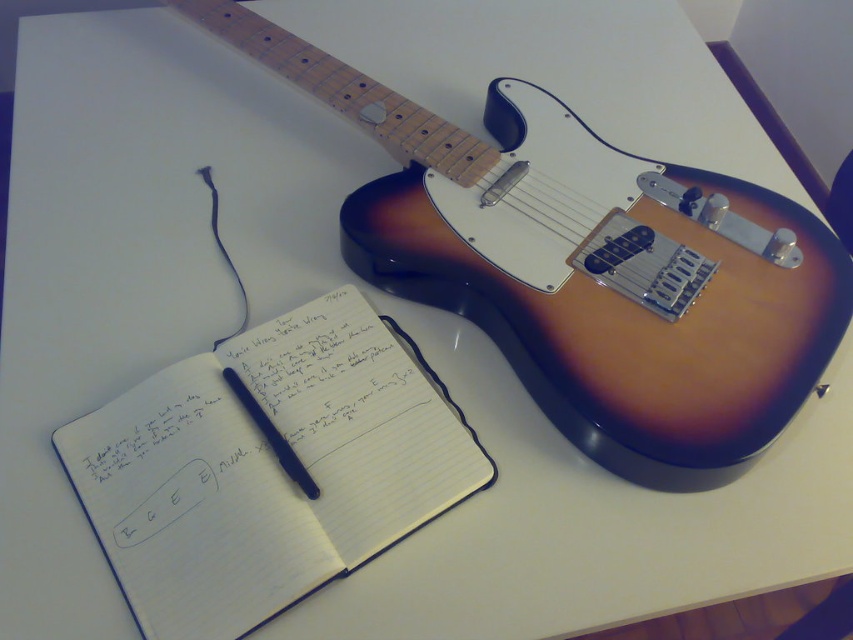
Question: Is the position of white lined paper at center more distant than that of matte black pen at center?

Choices:
 (A) no
 (B) yes

Answer: (A)

Question: Where is white lined paper at center located in relation to matte black pen at center in the image?

Choices:
 (A) below
 (B) above

Answer: (A)

Question: Estimate the real-world distances between objects in this image. Which object is farther from the white lined paper at center?

Choices:
 (A) satin wood guitar at upper right
 (B) matte black pen at center

Answer: (A)

Question: Which object appears closest to the camera in this image?

Choices:
 (A) satin wood guitar at upper right
 (B) white lined paper at center
 (C) matte black pen at center

Answer: (B)

Question: Which of the following is the farthest from the observer?

Choices:
 (A) satin wood guitar at upper right
 (B) white lined paper at center

Answer: (A)

Question: Does satin wood guitar at upper right come in front of white lined paper at center?

Choices:
 (A) no
 (B) yes

Answer: (A)